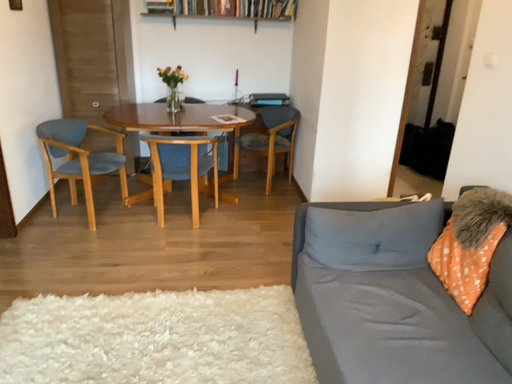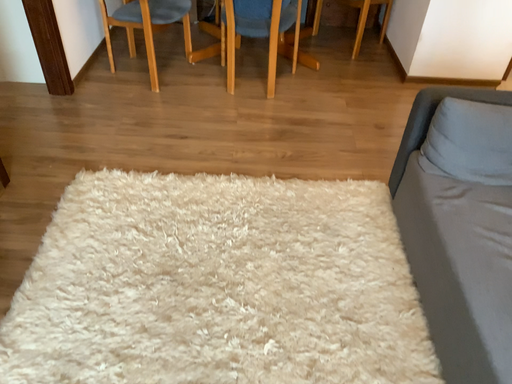
Question: Which way did the camera rotate in the video?

Choices:
 (A) rotated left
 (B) rotated right

Answer: (A)